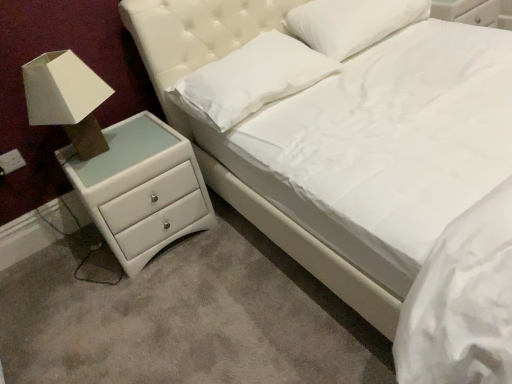
Question: Considering the positions of white leather chest of drawers at lower left and white fabric lampshade at left in the image, is white leather chest of drawers at lower left taller or shorter than white fabric lampshade at left?

Choices:
 (A) short
 (B) tall

Answer: (B)

Question: Relative to white fabric lampshade at left, is white leather chest of drawers at lower left in front or behind?

Choices:
 (A) front
 (B) behind

Answer: (B)

Question: Based on their relative distances, which object is farther from the white soft pillow at upper center, which appears as the first pillow when viewed from the left?

Choices:
 (A) white soft pillow at upper center, the first pillow positioned from the right
 (B) white leather chest of drawers at lower left
 (C) white fabric lampshade at left

Answer: (C)

Question: Which object is positioned closest to the white soft pillow at upper center, the first pillow positioned from the right?

Choices:
 (A) white leather chest of drawers at lower left
 (B) white fabric lampshade at left
 (C) white soft pillow at upper center, positioned as the 2th pillow in right-to-left order

Answer: (C)